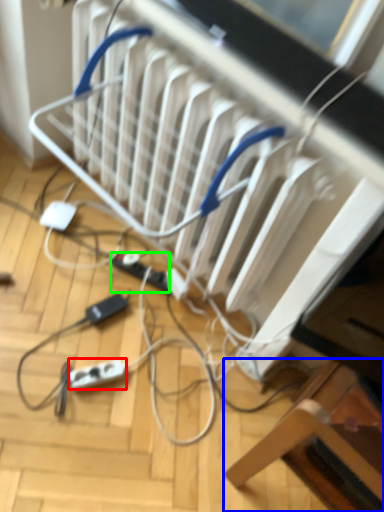
Question: Based on their relative distances, which object is nearer to extension cord (highlighted by a red box)? Choose from furniture (highlighted by a blue box) and extension cord (highlighted by a green box).

Choices:
 (A) furniture
 (B) extension cord

Answer: (B)